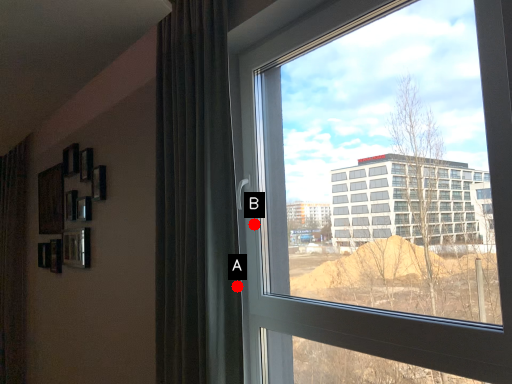
Question: Two points are circled on the image, labeled by A and B beside each circle. Which point is closer to the camera taking this photo?

Choices:
 (A) A is closer
 (B) B is closer

Answer: (A)